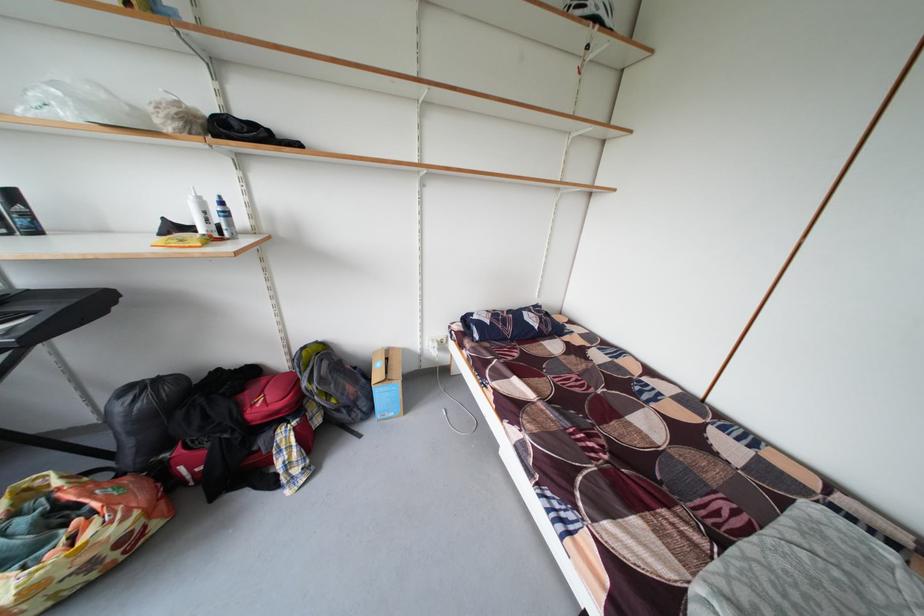
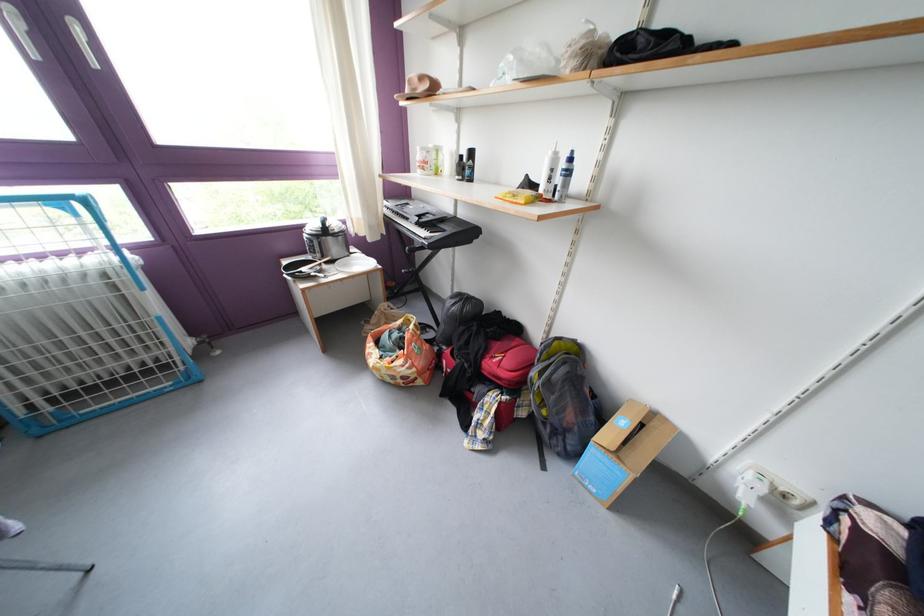
Find the pixel in the second image that matches point 186,233 in the first image.

(540, 191)